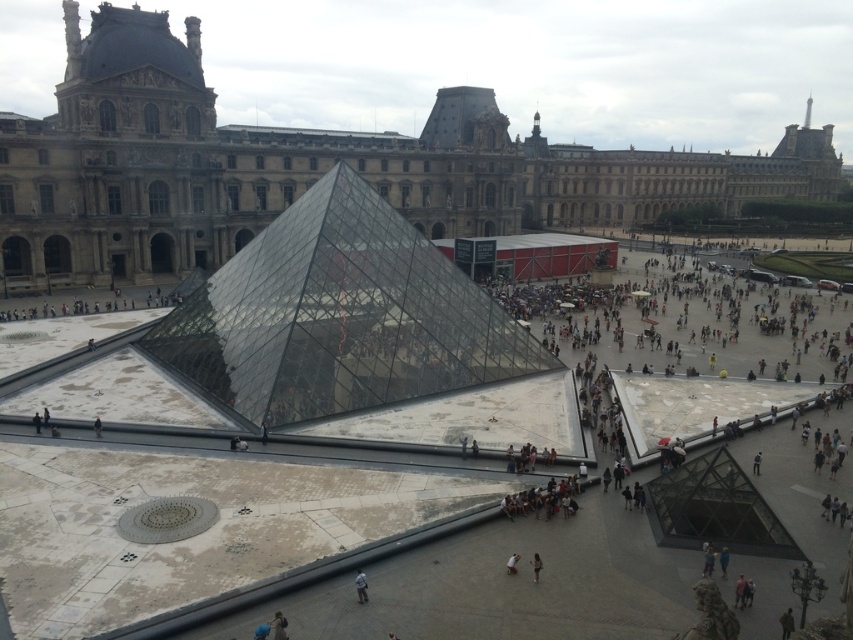
Is point (363, 602) behind point (94, 435)?

No, (363, 602) is closer to viewer.

The image size is (853, 640). In order to click on light gray fabric jacket at center in this screenshot , I will do `click(360, 586)`.

Locate an element on the screen. This screenshot has width=853, height=640. light brown fabric dress at center is located at coordinates (537, 566).

Measure the distance between point (532, 556) and camera.

Point (532, 556) and camera are 56.36 meters apart from each other.

Does point (532, 568) lie behind point (100, 432)?

No, it is in front of (100, 432).

Locate an element on the screen. This screenshot has height=640, width=853. light brown fabric dress at center is located at coordinates (537, 566).

Is light brown fabric dress at center positioned behind white fabric person at center?

No, it is not.

Is light brown fabric dress at center to the right of white fabric person at center from the viewer's perspective?

Correct, you'll find light brown fabric dress at center to the right of white fabric person at center.

Is point (537, 566) less distant than point (518, 556)?

Yes, point (537, 566) is in front of point (518, 556).

Locate an element on the screen. This screenshot has height=640, width=853. light brown fabric dress at center is located at coordinates (537, 566).